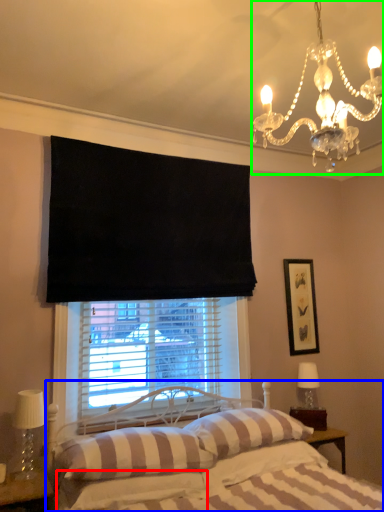
Question: Which object is positioned closest to sheet (highlighted by a red box)? Select from bed (highlighted by a blue box) and light fixture (highlighted by a green box).

Choices:
 (A) bed
 (B) light fixture

Answer: (A)